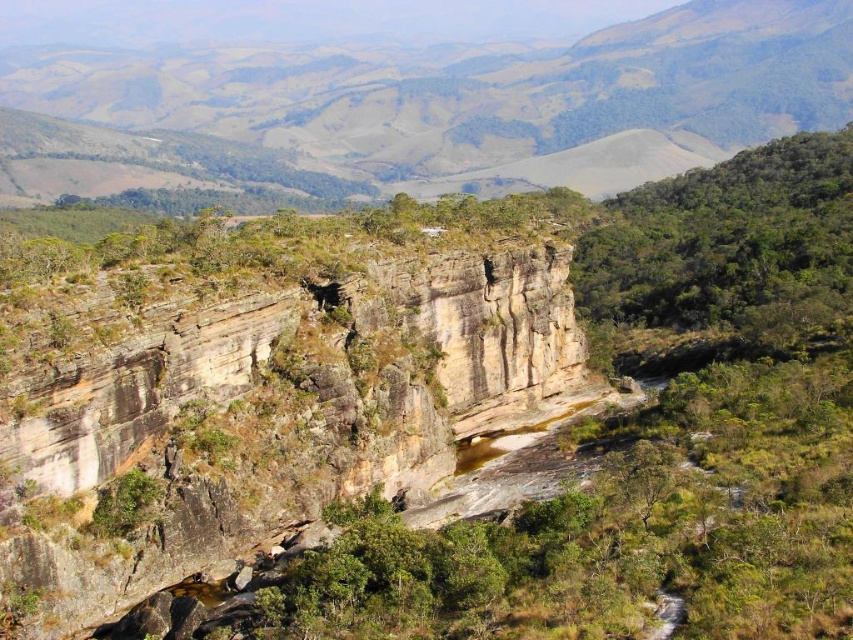
Based on the photo, you are a hiker planning to climb the brown rough rock face at center and the brown rocky cliff at upper center. Which one should you tackle first if you want to start with the smaller one?

You should tackle the brown rough rock face at center first because it has a smaller size compared to the brown rocky cliff at upper center.

You are a hiker who wants to take a photo of the brown rough rock face at center and the brown rocky cliff at upper center. Which one should you stand to the right of to capture both in your frame?

You should stand to the right of the brown rough rock face at center because it is positioned to the left of the brown rocky cliff at upper center, so standing to its right would allow both objects to be in your frame.

You are a hiker planning to cross the valley and need to choose between two paths. One path leads along the brown rough rock face at center, and the other goes around the brown rocky cliff at upper center. Considering their widths, which path would allow you to walk more comfortably?

The path along the brown rough rock face at center is thinner than the brown rocky cliff at upper center, so the path around the brown rocky cliff at upper center would provide a wider and more comfortable walking space.